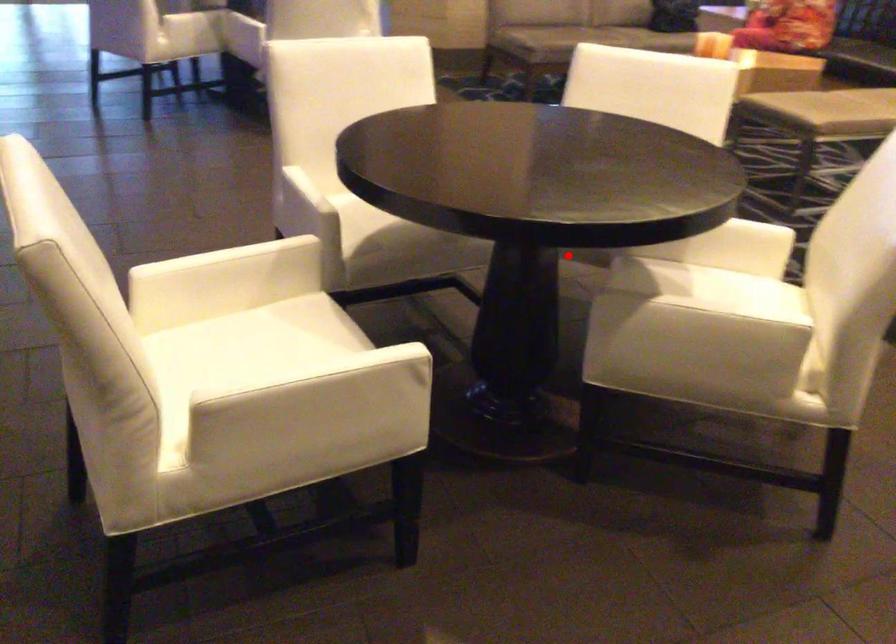
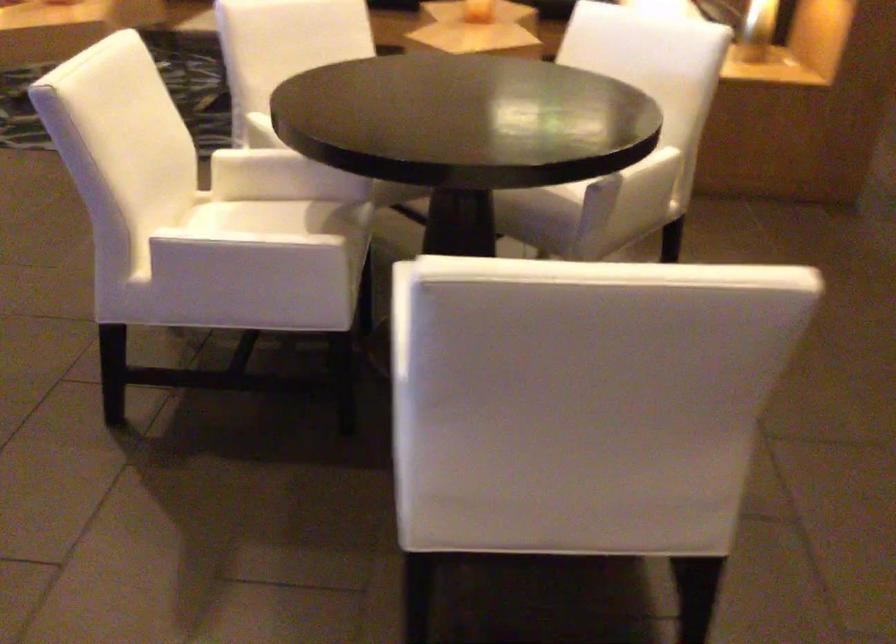
Where in the second image is the point corresponding to the highlighted location from the first image?

(385, 199)